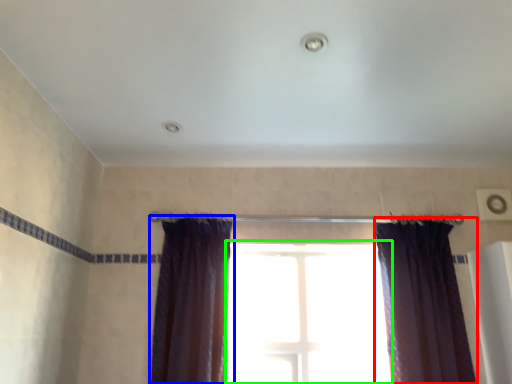
Question: Which object is the closest to the curtain (highlighted by a red box)? Choose among these: curtain (highlighted by a blue box) or window (highlighted by a green box).

Choices:
 (A) curtain
 (B) window

Answer: (B)